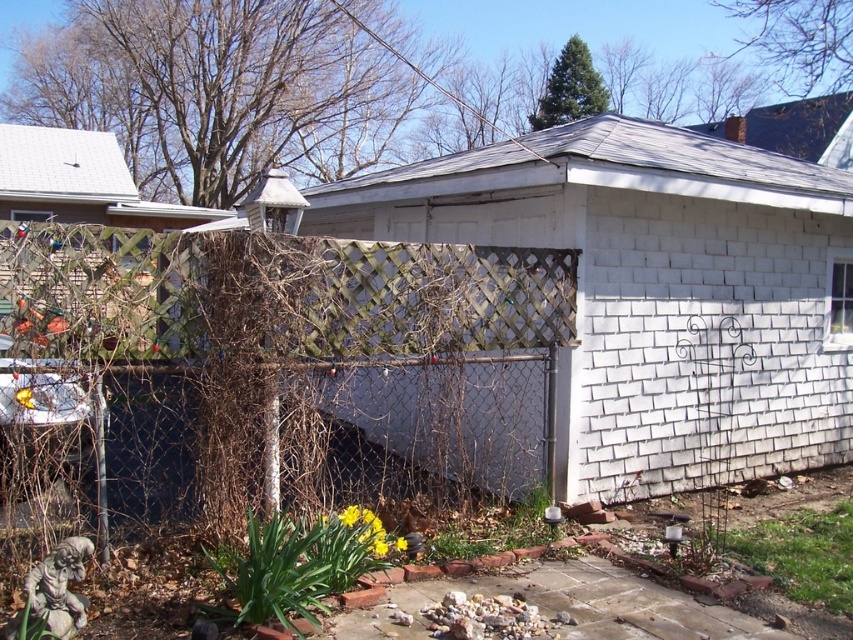
Question: Which point is closer to the camera taking this photo?

Choices:
 (A) (345, 513)
 (B) (433, 369)

Answer: (A)

Question: Does wooden lattice fence at left have a lesser width compared to yellow matte flower at lower center?

Choices:
 (A) yes
 (B) no

Answer: (B)

Question: Which object is farther from the camera taking this photo?

Choices:
 (A) wooden lattice fence at left
 (B) yellow matte flower at lower center

Answer: (B)

Question: Which point is farther from the camera taking this photo?

Choices:
 (A) (373, 552)
 (B) (392, 243)

Answer: (B)

Question: Can you confirm if wooden lattice fence at left is smaller than yellow matte flower at lower center?

Choices:
 (A) no
 (B) yes

Answer: (A)

Question: Is wooden lattice fence at left further to camera compared to yellow matte flower at lower center?

Choices:
 (A) yes
 (B) no

Answer: (B)